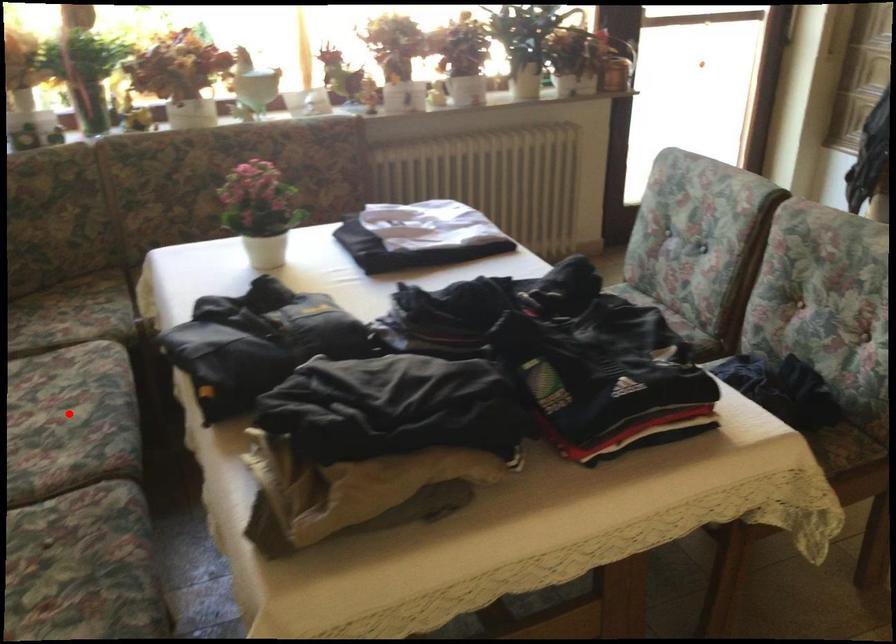
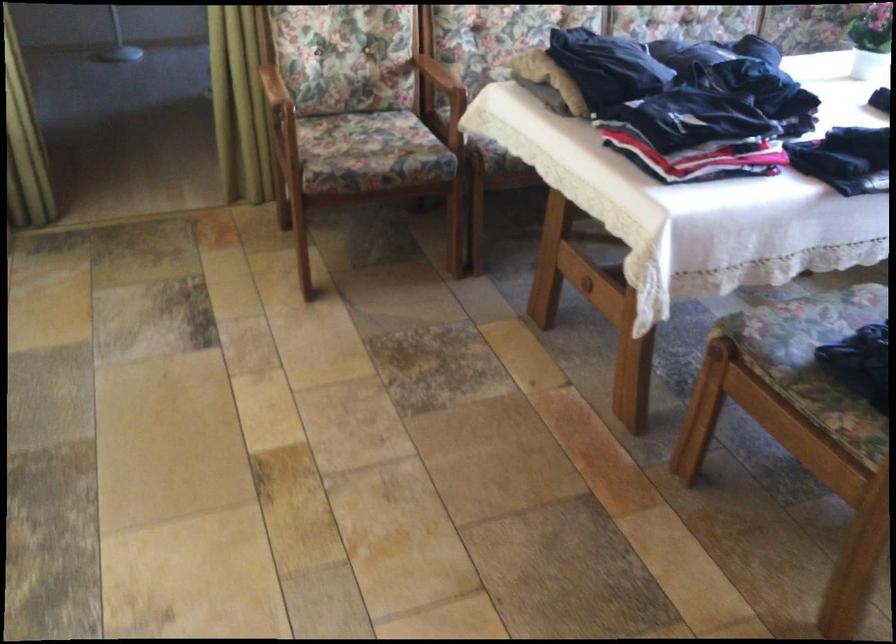
Question: I am providing you with two images of the same scene from different viewpoints. A red point is marked on the first image. Can you still see the location of the red point in image 2?

Choices:
 (A) Yes
 (B) No

Answer: (B)